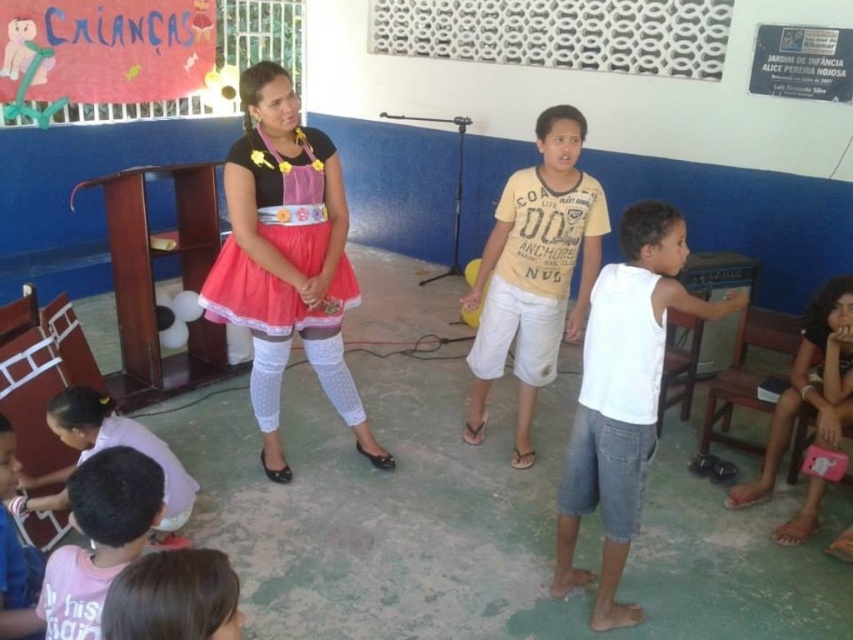
You are a photographer in the classroom and want to take a picture of the matte pink dress at center. Where should you position your camera to capture the dress in the frame?

The matte pink dress at center is located at point 0.405 on the horizontal axis and 0.336 on the vertical axis. To capture it in the frame, position the camera so that the dress is centered at those coordinates.

You are a photographer trying to capture the pink fabric shirt at lower left and the light pink fabric dress at lower left in a single shot. Which one should you adjust your camera angle to focus on first if you want to include both in the frame?

The pink fabric shirt at lower left is positioned on the right side of light pink fabric dress at lower left, so you should focus on the light pink fabric dress at lower left first to ensure both are included in the frame.